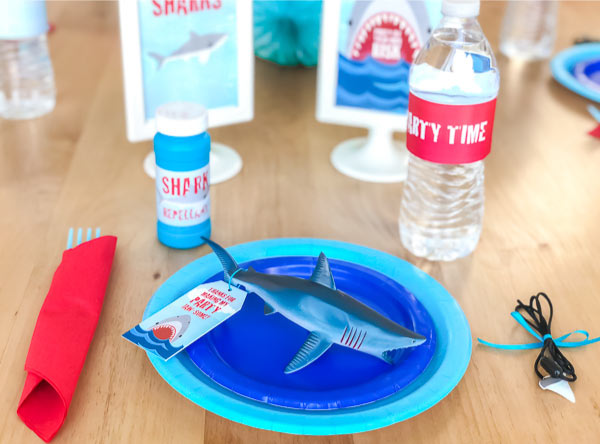
Identify the location of light blue dinner paper plate. The image size is (600, 444). (423, 407).